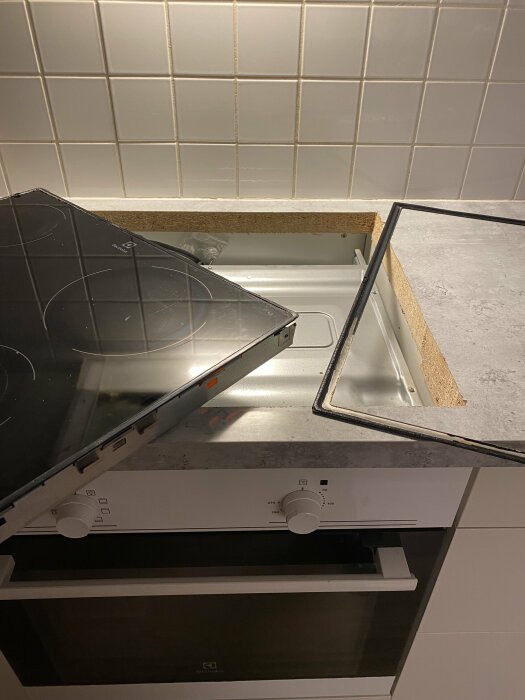
Locate an element on the screen. The height and width of the screenshot is (700, 525). counter top is located at coordinates point(495,325).